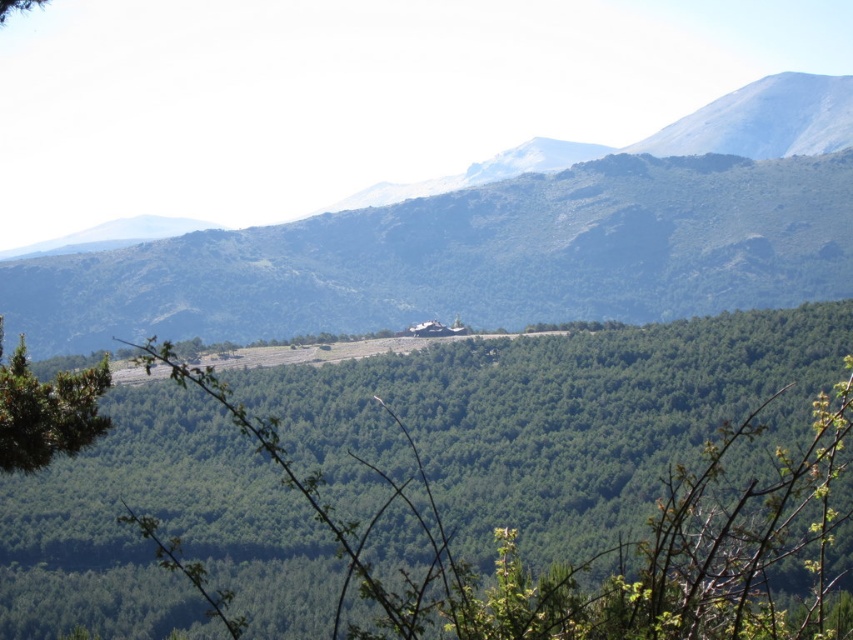
Question: Can you confirm if green matte mountain at center is positioned to the right of green leafy tree at center?

Choices:
 (A) no
 (B) yes

Answer: (B)

Question: Which object appears closest to the camera in this image?

Choices:
 (A) green matte mountain at center
 (B) green leafy tree at lower left

Answer: (B)

Question: Among these objects, which one is nearest to the camera?

Choices:
 (A) green matte mountain at center
 (B) green leafy tree at lower left

Answer: (B)

Question: Among these objects, which one is farthest from the camera?

Choices:
 (A) green leafy tree at center
 (B) green matte mountain at center
 (C) green leafy tree at lower left

Answer: (B)

Question: Can you confirm if green matte mountain at center is thinner than green leafy tree at lower left?

Choices:
 (A) no
 (B) yes

Answer: (A)

Question: Is green matte mountain at center smaller than green leafy tree at lower left?

Choices:
 (A) no
 (B) yes

Answer: (A)